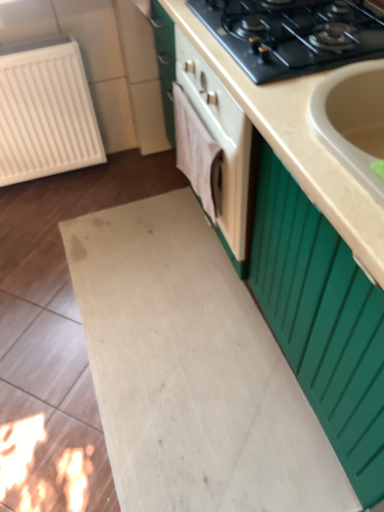
Find the location of a particular element. The height and width of the screenshot is (512, 384). white plastic radiator at left is located at coordinates pyautogui.click(x=45, y=111).

The width and height of the screenshot is (384, 512). What are the coordinates of `black matte gas stove at upper center` in the screenshot? It's located at (291, 34).

From a real-world perspective, between black matte gas stove at upper center and beige matte countertop at center, who is vertically lower?

beige matte countertop at center, from a real-world perspective.

Looking at their sizes, would you say black matte gas stove at upper center is wider or thinner than beige matte countertop at center?

black matte gas stove at upper center is thinner than beige matte countertop at center.

From the picture: Between black matte gas stove at upper center and beige matte countertop at center, which one is positioned in front?

beige matte countertop at center is in front.

Does black matte gas stove at upper center appear on the right side of beige matte countertop at center?

No, black matte gas stove at upper center is not to the right of beige matte countertop at center.

Can you tell me how much white plastic radiator at left and black matte gas stove at upper center differ in facing direction?

There is a 90-degree angle between the facing directions of white plastic radiator at left and black matte gas stove at upper center.

From the image's perspective, between white plastic radiator at left and black matte gas stove at upper center, which one is located above?

From the image's view, black matte gas stove at upper center is above.

Which is behind, point (66, 163) or point (312, 64)?

The point (66, 163) is farther from the camera.

Considering the sizes of white plastic radiator at left and black matte gas stove at upper center in the image, is white plastic radiator at left taller or shorter than black matte gas stove at upper center?

Considering their sizes, white plastic radiator at left has more height than black matte gas stove at upper center.

Is white plastic radiator at left not close to beige matte countertop at center?

They are positioned close to each other.

Consider the image. Looking at their sizes, would you say white plastic radiator at left is wider or thinner than beige matte countertop at center?

In the image, white plastic radiator at left appears to be more narrow than beige matte countertop at center.

Considering the relative sizes of white plastic radiator at left and beige matte countertop at center in the image provided, is white plastic radiator at left bigger than beige matte countertop at center?

No, white plastic radiator at left is not bigger than beige matte countertop at center.

Does beige matte countertop at center have a greater height compared to black matte gas stove at upper center?

Correct, beige matte countertop at center is much taller as black matte gas stove at upper center.

Is beige matte countertop at center completely or partially outside of black matte gas stove at upper center?

beige matte countertop at center is positioned outside black matte gas stove at upper center.

Identify the location of countertop located below the black matte gas stove at upper center (from the image's perspective). This screenshot has width=384, height=512. (297, 144).

From the image's perspective, is beige matte countertop at center on top of black matte gas stove at upper center?

Incorrect, from the image's perspective, beige matte countertop at center is lower than black matte gas stove at upper center.

Relative to white plastic radiator at left, is beige matte countertop at center in front or behind?

Clearly, beige matte countertop at center is in front of white plastic radiator at left.

Does point (290, 133) appear closer or farther from the camera than point (60, 118)?

Point (290, 133) is closer to the camera than point (60, 118).

Considering the sizes of objects beige matte countertop at center and white plastic radiator at left in the image provided, who is shorter, beige matte countertop at center or white plastic radiator at left?

Standing shorter between the two is white plastic radiator at left.

Identify the location of gas stove above the white plastic radiator at left (from the image's perspective). click(x=291, y=34).

Does black matte gas stove at upper center have a lesser height compared to white plastic radiator at left?

Yes, black matte gas stove at upper center is shorter than white plastic radiator at left.

Is black matte gas stove at upper center bigger or smaller than white plastic radiator at left?

In the image, black matte gas stove at upper center appears to be smaller than white plastic radiator at left.

From the image's perspective, is black matte gas stove at upper center positioned above or below white plastic radiator at left?

From the image's perspective, black matte gas stove at upper center appears above white plastic radiator at left.

The image size is (384, 512). Find the location of `countertop below the black matte gas stove at upper center (from a real-world perspective)`. countertop below the black matte gas stove at upper center (from a real-world perspective) is located at coordinates (297, 144).

At what (x,y) coordinates should I click in order to perform the action: click on gas stove above the white plastic radiator at left (from a real-world perspective). Please return your answer as a coordinate pair (x, y). Looking at the image, I should click on (291, 34).

Based on their spatial positions, is beige matte countertop at center or white plastic radiator at left closer to black matte gas stove at upper center?

Among the two, beige matte countertop at center is located nearer to black matte gas stove at upper center.

Looking at the image, which one is located further to black matte gas stove at upper center, white plastic radiator at left or beige matte countertop at center?

white plastic radiator at left is positioned further to the anchor black matte gas stove at upper center.

Which object lies further to the anchor point white plastic radiator at left, black matte gas stove at upper center or beige matte countertop at center?

Based on the image, black matte gas stove at upper center appears to be further to white plastic radiator at left.

Estimate the real-world distances between objects in this image. Which object is further from white plastic radiator at left, beige matte countertop at center or black matte gas stove at upper center?

Based on the image, black matte gas stove at upper center appears to be further to white plastic radiator at left.

Which object lies nearer to the anchor point beige matte countertop at center, white plastic radiator at left or black matte gas stove at upper center?

black matte gas stove at upper center is positioned closer to the anchor beige matte countertop at center.

Looking at the image, which one is located closer to beige matte countertop at center, black matte gas stove at upper center or white plastic radiator at left?

Based on the image, black matte gas stove at upper center appears to be nearer to beige matte countertop at center.

Locate an element on the screen. The height and width of the screenshot is (512, 384). gas stove between white plastic radiator at left and beige matte countertop at center is located at coordinates (291, 34).